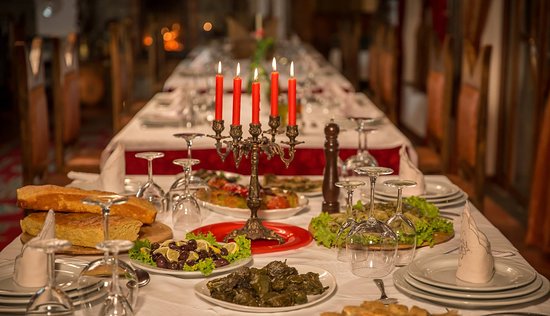
At what (x,y) coordinates should I click in order to perform the action: click on spoon. Please return your answer as a coordinate pair (x, y). The image size is (550, 316). Looking at the image, I should click on (382, 290).